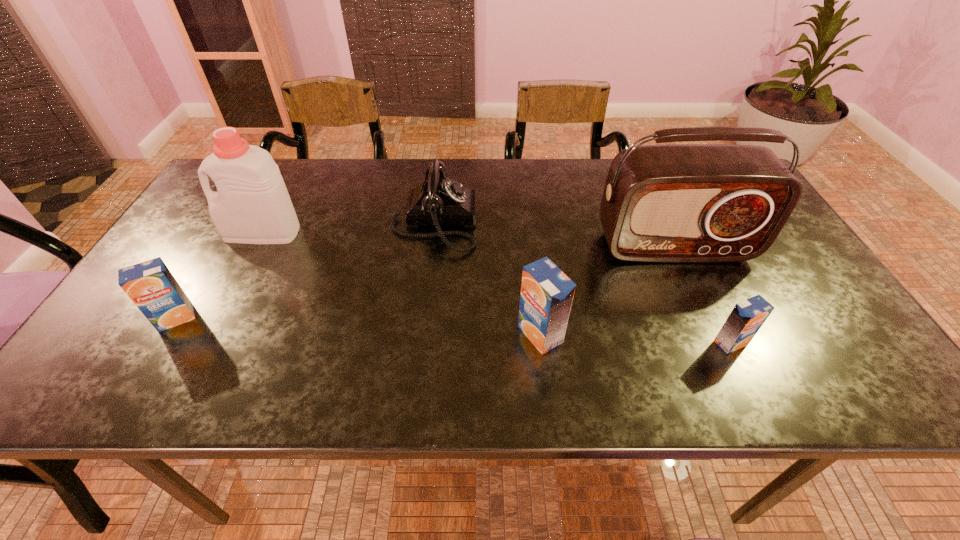
Where is `location for an additional orange_juice to make spacing equal`? This screenshot has height=540, width=960. location for an additional orange_juice to make spacing equal is located at coordinates (355, 326).